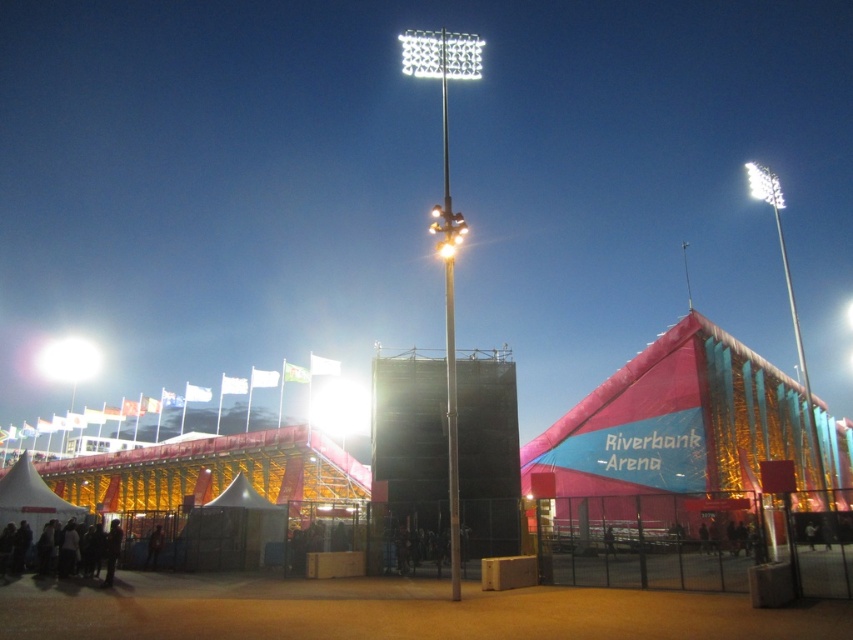
You are standing at the entrance of the Riverbank Arena and see the dark clothing at lower left and the white plastic floodlight at upper center. Which object is closer to your left side?

The dark clothing at lower left is closer to your left side because it is positioned to the left of the white plastic floodlight at upper center.

You are standing at the entrance of the Riverbank Arena and notice two items in the image. One is dark clothing at lower left and the other is white plastic floodlight at upper center. Which item is positioned higher up in the image?

The white plastic floodlight at upper center is positioned higher up in the image than the dark clothing at lower left.